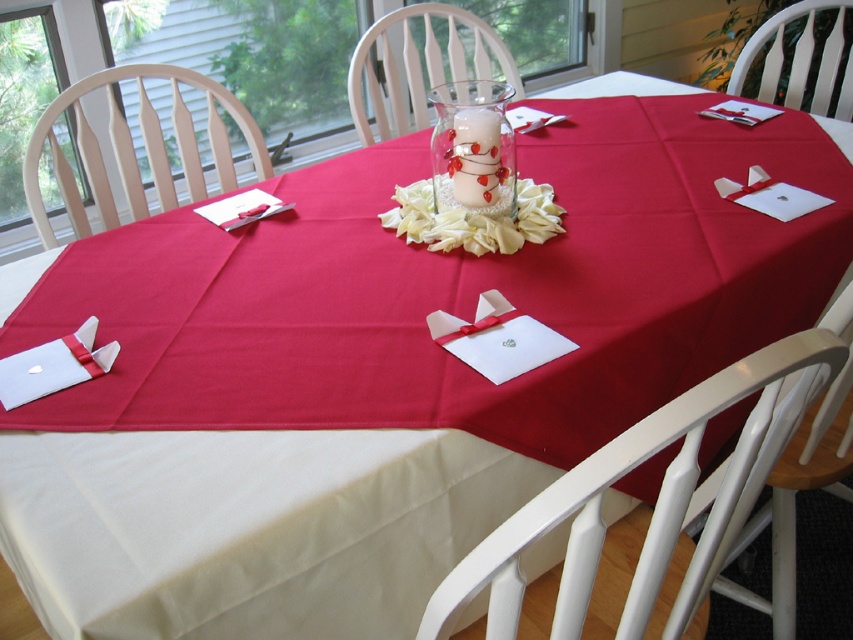
You are a guest sitting at the dining table and want to reach both the clear glass vase at center and the white fabric flower at center. Which object will your hand have to move less to touch?

The clear glass vase at center is closer to the viewer than the white fabric flower at center, so your hand will have to move less to touch the clear glass vase at center.

You are planning to place a decorative item on the dining table. The clear glass vase at center and the white fabric flower at center are already there. If you want to add another item between them, which object should you consider moving to make space?

The clear glass vase at center has a smaller width than the white fabric flower at center. To make space between them, you should consider moving the clear glass vase at center since it takes up less space and can be shifted to accommodate the new item.

You are a guest at the romantic dinner and want to place your napkin on the table. The napkin is currently on the white fabric flower at center. To move it to the clear glass vase at center, which direction should you move it?

The clear glass vase at center is to the left of the white fabric flower at center, so you should move the napkin to the left to place it on the clear glass vase at center.